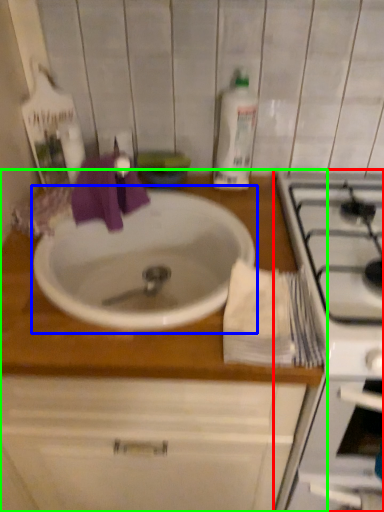
Question: Which object is the closest to the appliance (highlighted by a red box)? Choose among these: sink (highlighted by a blue box) or countertop (highlighted by a green box).

Choices:
 (A) sink
 (B) countertop

Answer: (B)